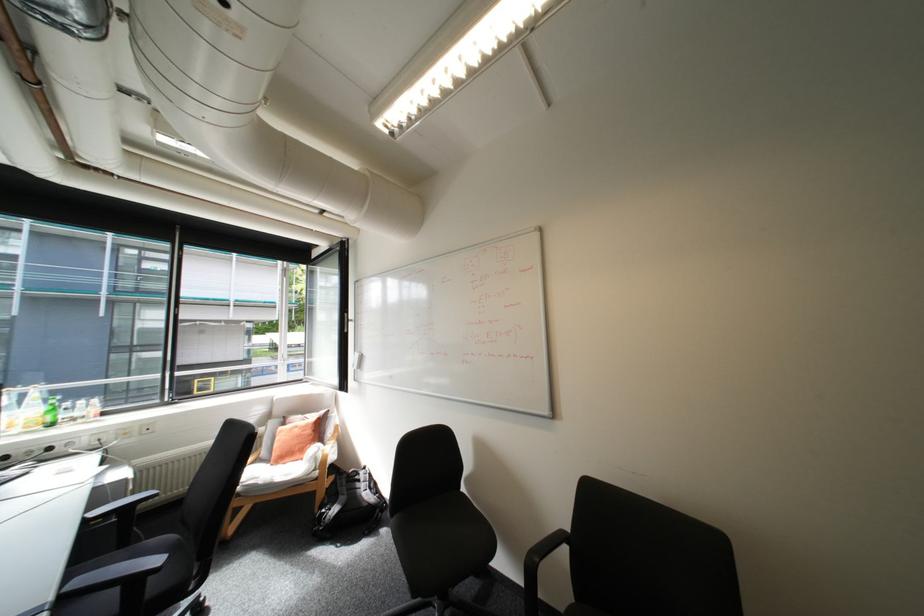
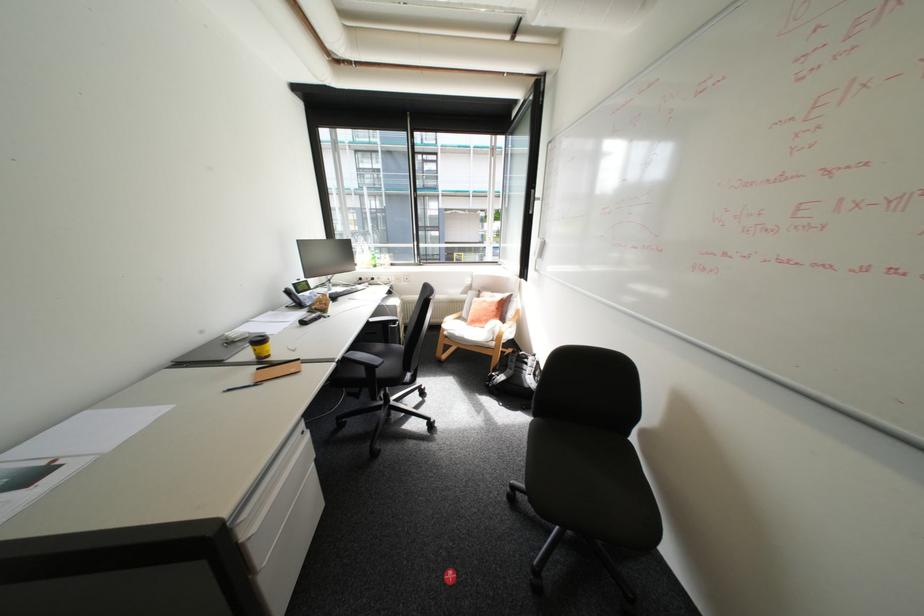
Based on the continuous images, in which direction is the camera rotating?

The camera rotated toward left-down.